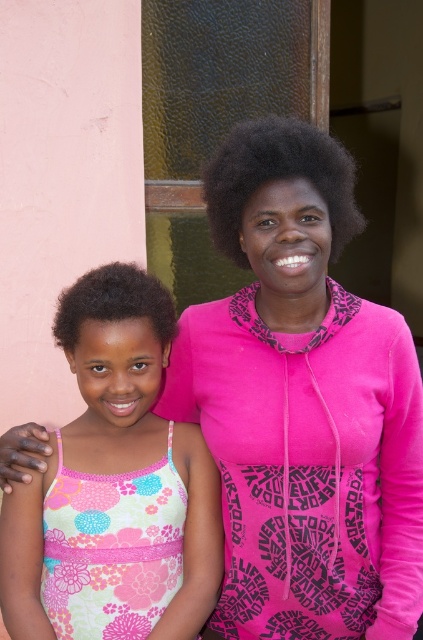
Can you confirm if black curly hair at center is thinner than dark curly hair at center?

No.

How far apart are black curly hair at center and dark curly hair at center?

They are 10.44 inches apart.

Where is `black curly hair at center`? black curly hair at center is located at coordinates (277, 179).

Is floral fabric dress at center bigger than floral-patterned fabric dress at lower left?

Yes, floral fabric dress at center is bigger than floral-patterned fabric dress at lower left.

Does floral fabric dress at center come behind floral-patterned fabric dress at lower left?

No, it is not.

Does point (3, 595) come in front of point (104, 515)?

That is True.

Find the location of a particular element. floral fabric dress at center is located at coordinates (139, 419).

Can you confirm if floral-patterned fabric dress at lower left is thinner than dark curly hair at center?

In fact, floral-patterned fabric dress at lower left might be wider than dark curly hair at center.

Between floral-patterned fabric dress at lower left and dark curly hair at center, which one appears on the right side from the viewer's perspective?

floral-patterned fabric dress at lower left is more to the right.

Is point (71, 625) in front of point (60, 301)?

That is True.

Where is `floral-patterned fabric dress at lower left`? The image size is (423, 640). floral-patterned fabric dress at lower left is located at coordinates (112, 548).